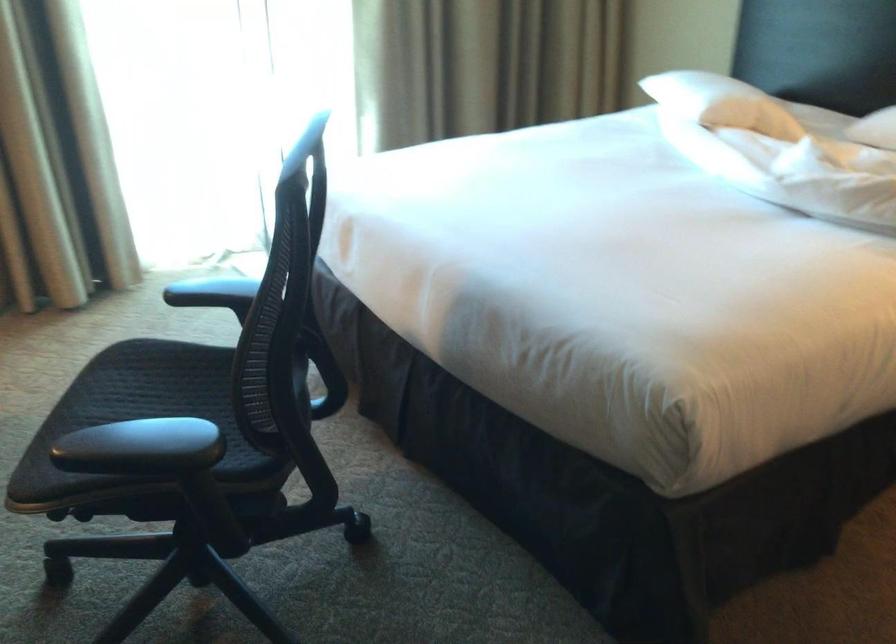
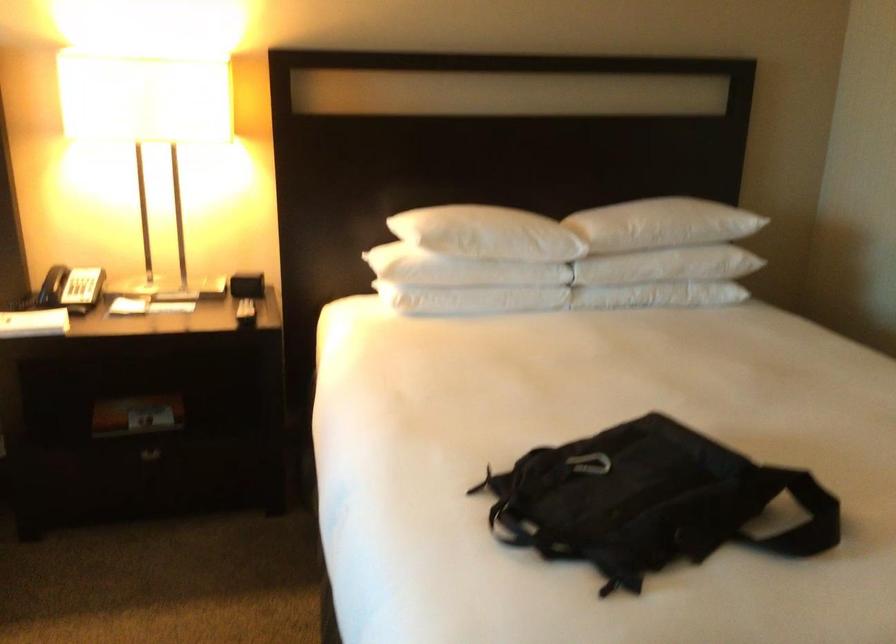
Question: The first image is from the beginning of the video and the second image is from the end. How did the camera likely rotate when shooting the video?

Choices:
 (A) Left
 (B) Right
 (C) Up
 (D) Down

Answer: (B)